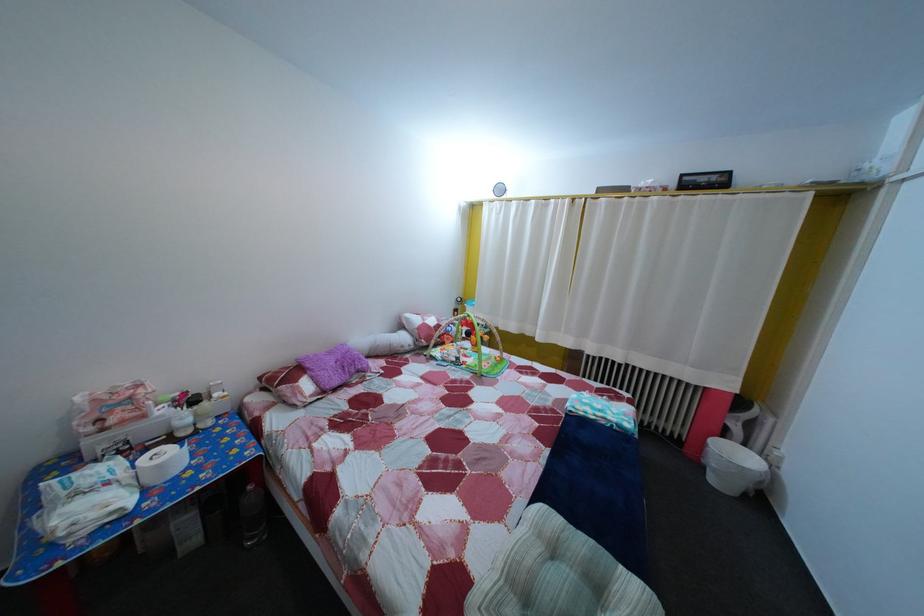
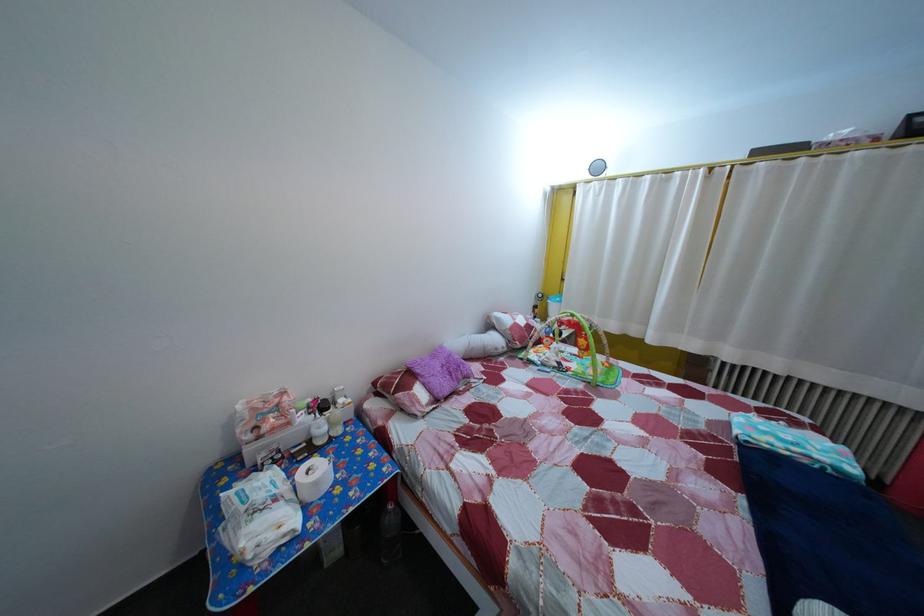
Where in the second image is the point corresponding to [464,367] from the first image?

(565, 371)